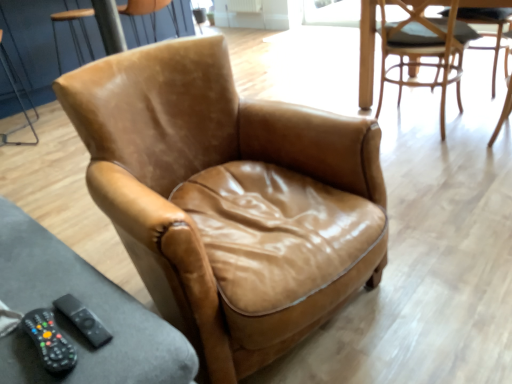
Question: Is black plastic remote at lower left inside the boundaries of brown leather armchair at upper left, the 1th chair when ordered from back to front, or outside?

Choices:
 (A) inside
 (B) outside

Answer: (B)

Question: Is black plastic remote at lower left in front of or behind brown leather armchair at upper left, which is counted as the 3th chair, starting from the front, in the image?

Choices:
 (A) behind
 (B) front

Answer: (B)

Question: Which of these objects is positioned farthest from the black plastic remote at lower left?

Choices:
 (A) black rubber remote control at lower left
 (B) brown leather armchair at upper left, marked as the first chair in a left-to-right arrangement
 (C) leather armchair at center, which is the second chair in right-to-left order
 (D) light brown leather chair at upper right, acting as the 2th chair starting from the front

Answer: (B)

Question: Which is nearer to the black plastic remote at lower left?

Choices:
 (A) brown leather armchair at upper left, which is counted as the third chair, starting from the right
 (B) black rubber remote control at lower left
 (C) light brown leather chair at upper right, which is the second chair in back-to-front order
 (D) leather armchair at center, the 3th chair in the back-to-front sequence

Answer: (B)